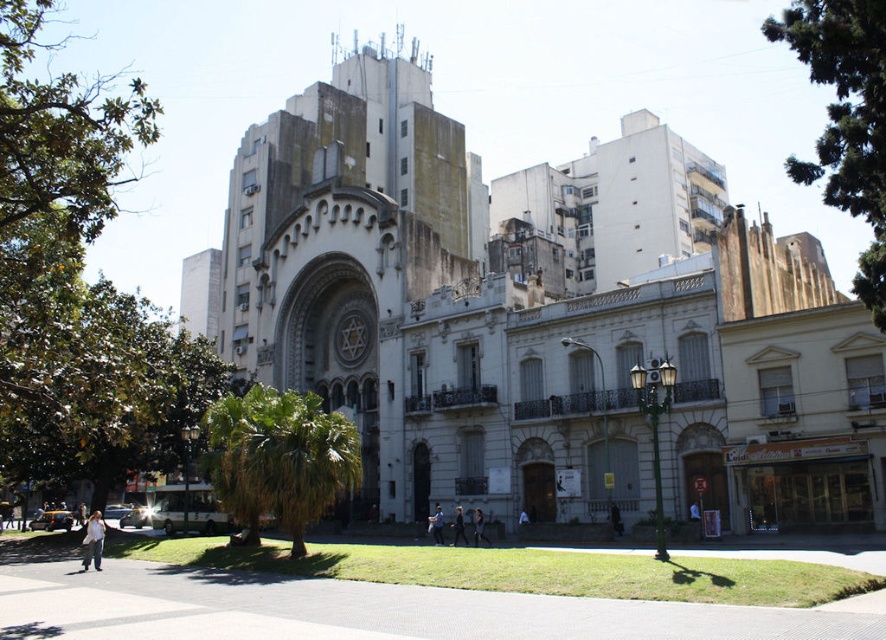
Does white stone church at center have a larger size compared to dark brown leather jacket at center?

Indeed, white stone church at center has a larger size compared to dark brown leather jacket at center.

Who is more forward, (296, 378) or (478, 524)?

Positioned in front is point (478, 524).

The width and height of the screenshot is (886, 640). Find the location of `white stone church at center`. white stone church at center is located at coordinates (496, 300).

Is point (437, 508) closer to camera compared to point (459, 509)?

That is False.

The image size is (886, 640). What do you see at coordinates (436, 525) in the screenshot? I see `dark blue jeans at center` at bounding box center [436, 525].

Who is more forward, (441, 538) or (467, 541)?

Point (467, 541) is in front.

Identify the location of dark blue jeans at center. (436, 525).

The image size is (886, 640). Find the location of `light blue denim jeans at lower left`. light blue denim jeans at lower left is located at coordinates (92, 540).

Can you confirm if light blue denim jeans at lower left is smaller than dark brown leather jacket at center?

No.

Does point (88, 544) lie in front of point (476, 541)?

Yes, it is.

Identify the location of light blue denim jeans at lower left. This screenshot has width=886, height=640. (92, 540).